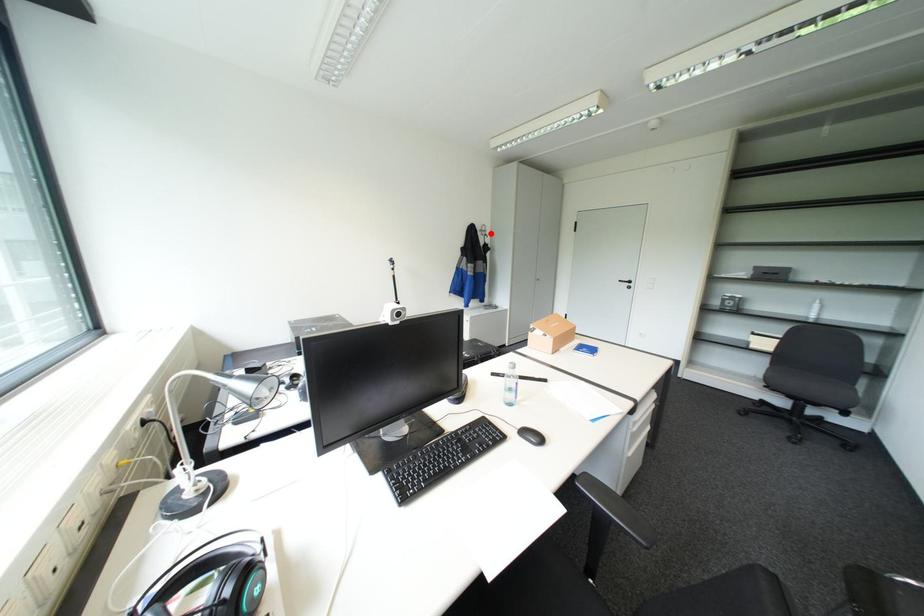
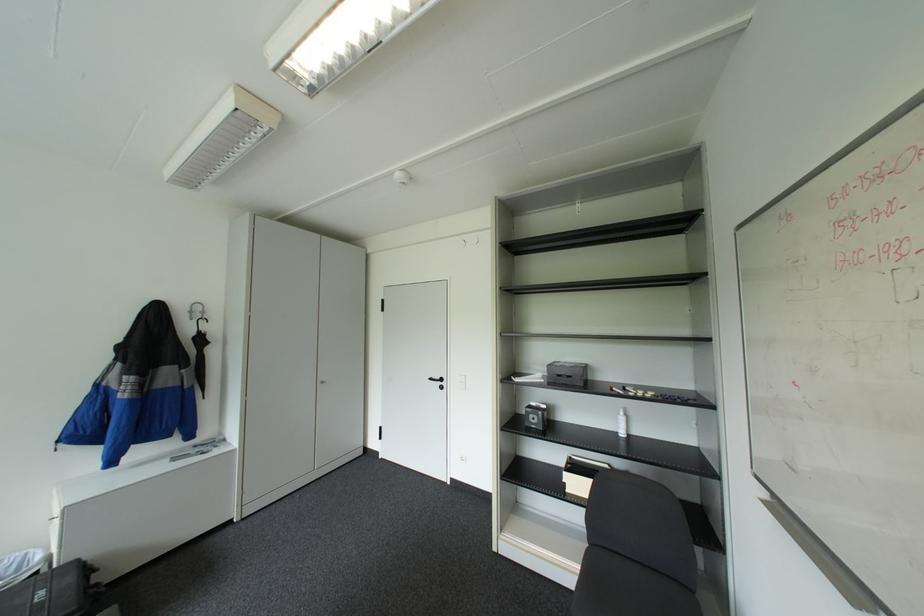
Find the pixel in the second image that matches the highlighted location in the first image.

(200, 318)